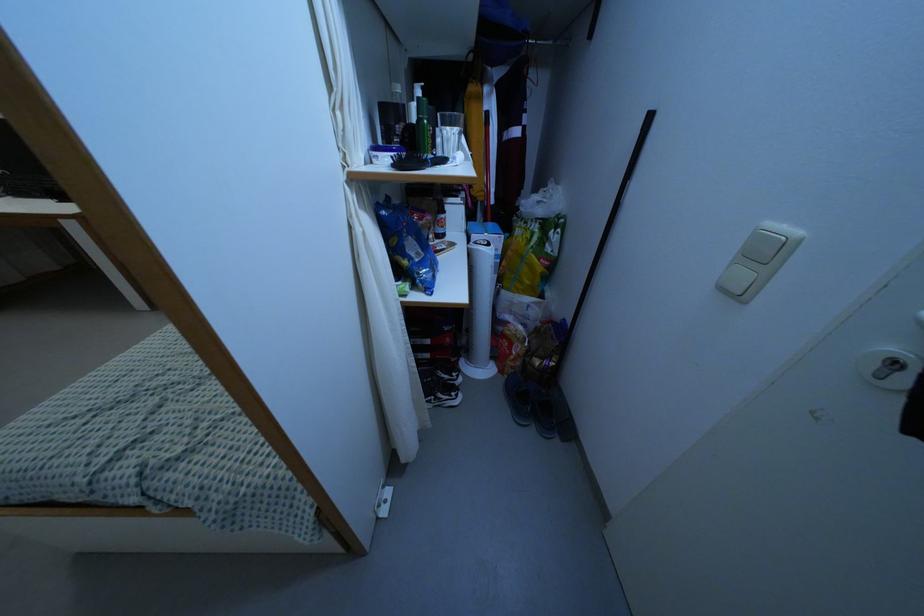
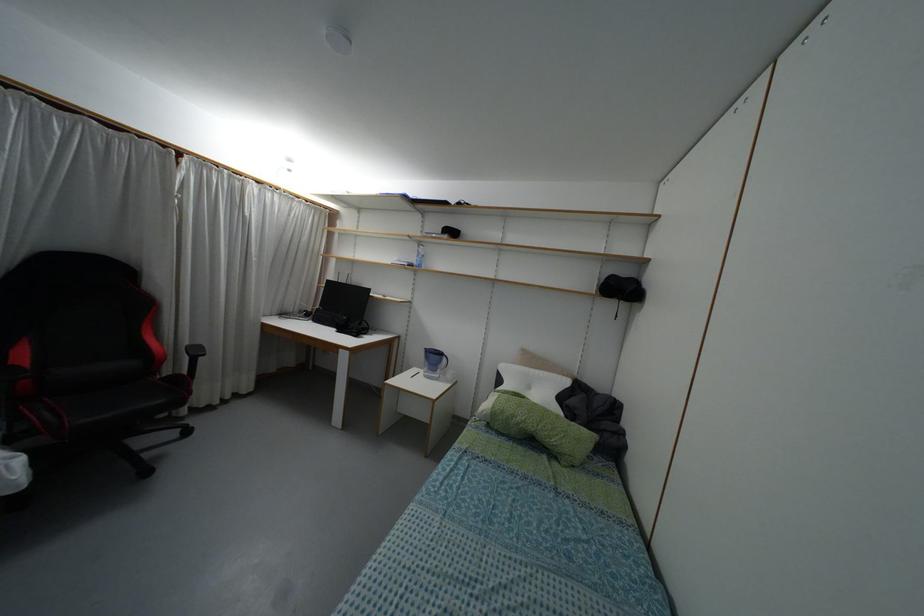
First-person continuous shooting, in which direction is the camera rotating?

The rotation direction of the camera is left-up.